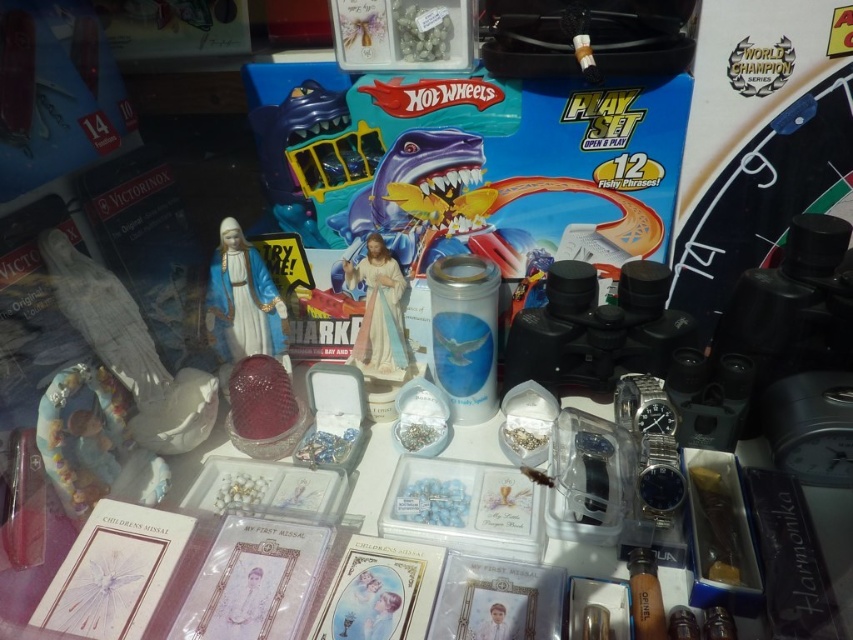
Measure the distance between matte porcelain statue at center-left and camera.

matte porcelain statue at center-left is 99.71 centimeters from camera.

Does matte porcelain statue at center-left lie in front of matte porcelain statue at center?

Yes.

Where is `matte porcelain statue at center-left`? matte porcelain statue at center-left is located at coordinates (242, 300).